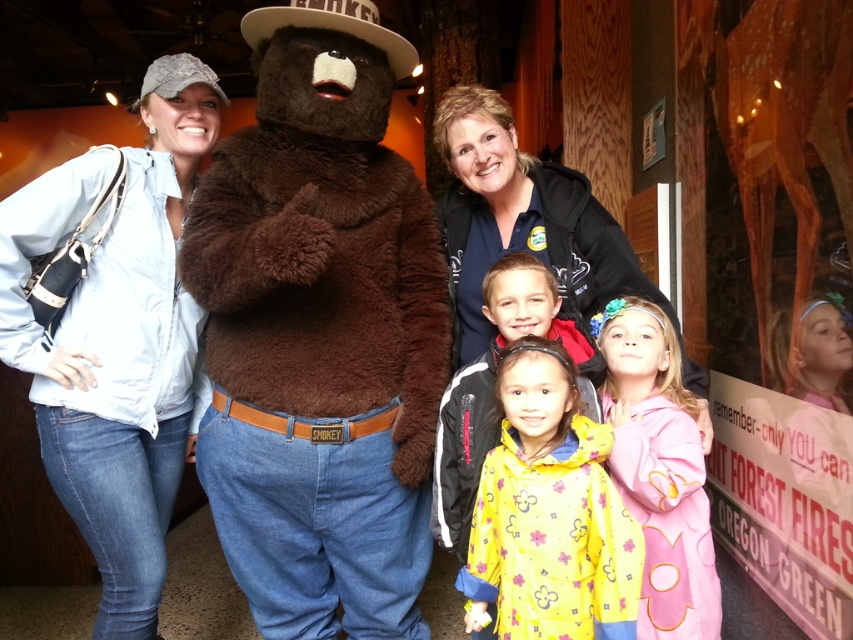
Question: Is light blue denim jeans at left smaller than yellow fabric at center?

Choices:
 (A) no
 (B) yes

Answer: (A)

Question: Can you confirm if blue fleece jacket at upper center is positioned below matte pink hoodie at center?

Choices:
 (A) yes
 (B) no

Answer: (B)

Question: Does matte pink hoodie at center have a greater width compared to yellow fabric at center?

Choices:
 (A) no
 (B) yes

Answer: (A)

Question: Which point is farther to the camera?

Choices:
 (A) 517,608
 (B) 578,253
 (C) 497,417

Answer: (B)

Question: Among these points, which one is farthest from the camera?

Choices:
 (A) (158, 458)
 (B) (541, 340)
 (C) (402, 637)

Answer: (A)

Question: Which of these objects is positioned farthest from the light blue denim jeans at left?

Choices:
 (A) yellow fabric raincoat at lower center
 (B) blue fleece jacket at upper center
 (C) yellow fabric at center

Answer: (A)